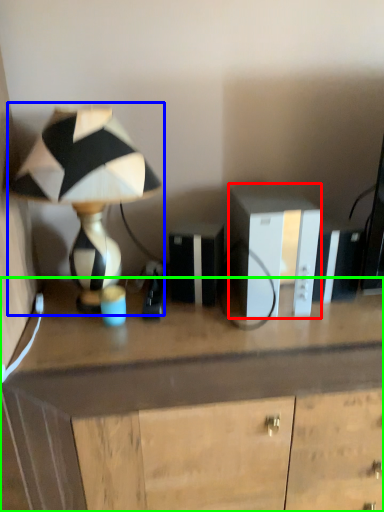
Question: Based on their relative distances, which object is nearer to cabinetry (highlighted by a red box)? Choose from lamp (highlighted by a blue box) and desk (highlighted by a green box).

Choices:
 (A) lamp
 (B) desk

Answer: (B)